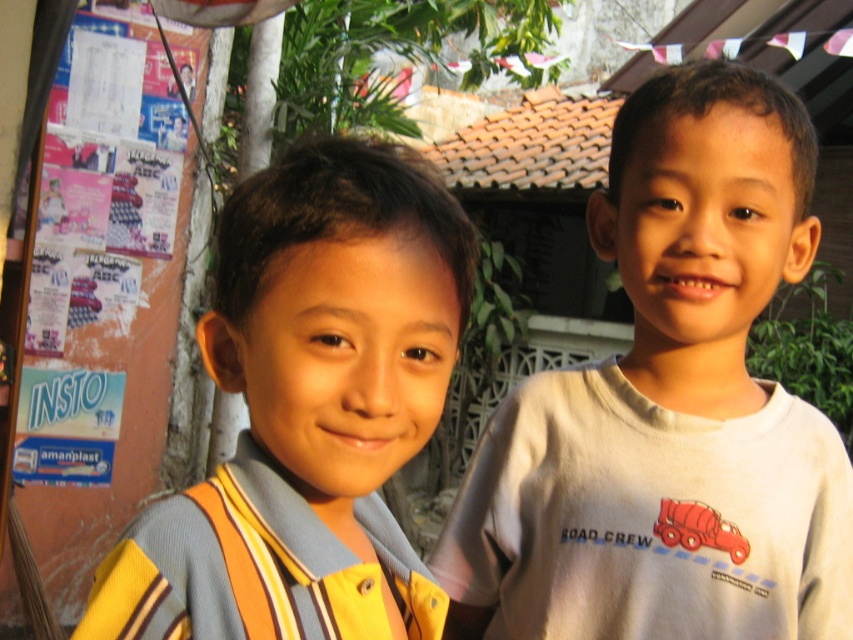
Does point (413, 166) lie behind point (61, 131)?

No, (413, 166) is closer to viewer.

Is yellow striped shirt at center bigger than orange paper posters at left?

Incorrect, yellow striped shirt at center is not larger than orange paper posters at left.

Is point (367, 257) positioned after point (161, 209)?

That is False.

The image size is (853, 640). In order to click on yellow striped shirt at center in this screenshot , I will do `click(308, 410)`.

Does white cotton shirt at right have a greater width compared to yellow striped shirt at center?

Yes.

Is white cotton shirt at right to the left of yellow striped shirt at center from the viewer's perspective?

In fact, white cotton shirt at right is to the right of yellow striped shirt at center.

Locate an element on the screen. white cotton shirt at right is located at coordinates click(669, 406).

Locate an element on the screen. white cotton shirt at right is located at coordinates (669, 406).

Is point (633, 237) less distant than point (157, 218)?

Yes, it is in front of point (157, 218).

Does white cotton shirt at right have a lesser height compared to orange paper posters at left?

Yes.

Between point (672, 346) and point (94, 22), which one is positioned in front?

Point (672, 346)

Where is `white cotton shirt at right`? This screenshot has height=640, width=853. white cotton shirt at right is located at coordinates tap(669, 406).